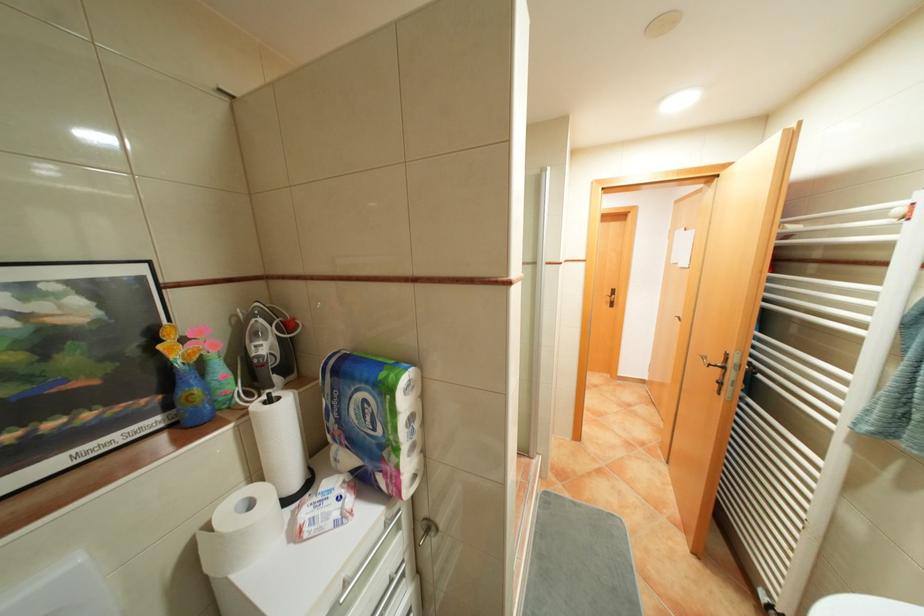
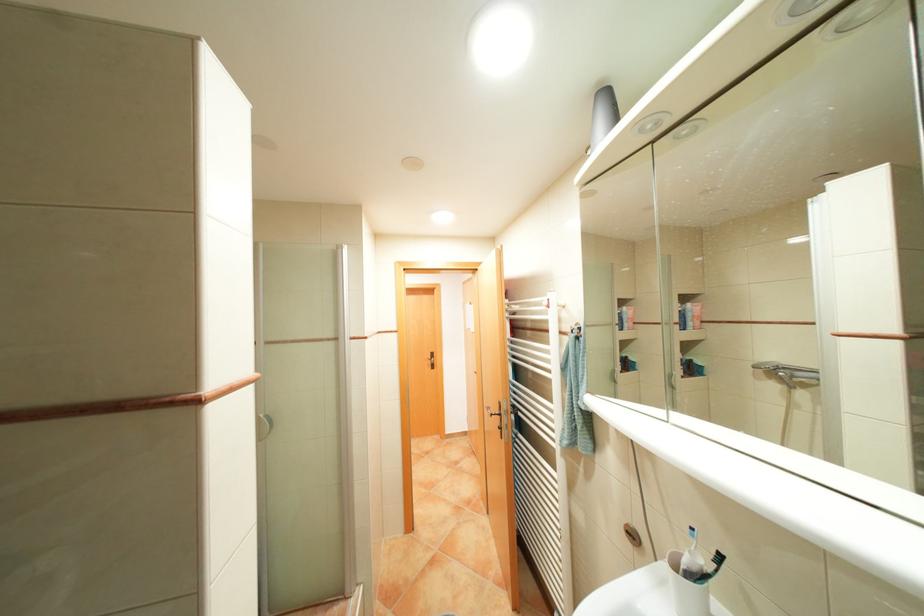
Locate, in the second image, the point that corresponds to (734,367) in the first image.

(509, 413)